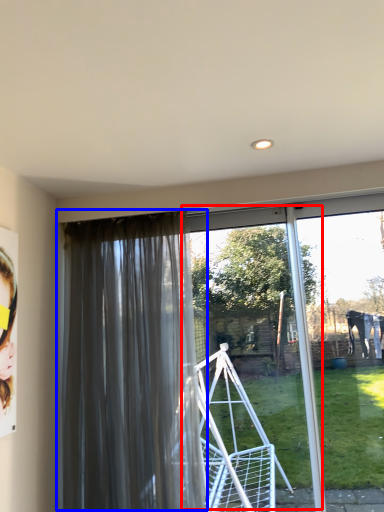
Question: Among these objects, which one is farthest to the camera, screen door (highlighted by a red box) or curtain (highlighted by a blue box)?

Choices:
 (A) screen door
 (B) curtain

Answer: (A)